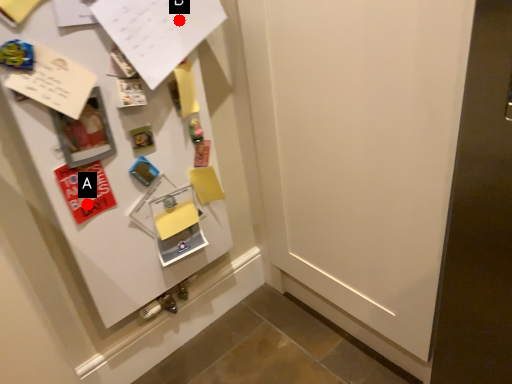
Question: Two points are circled on the image, labeled by A and B beside each circle. Which point appears farthest from the camera in this image?

Choices:
 (A) A is further
 (B) B is further

Answer: (B)